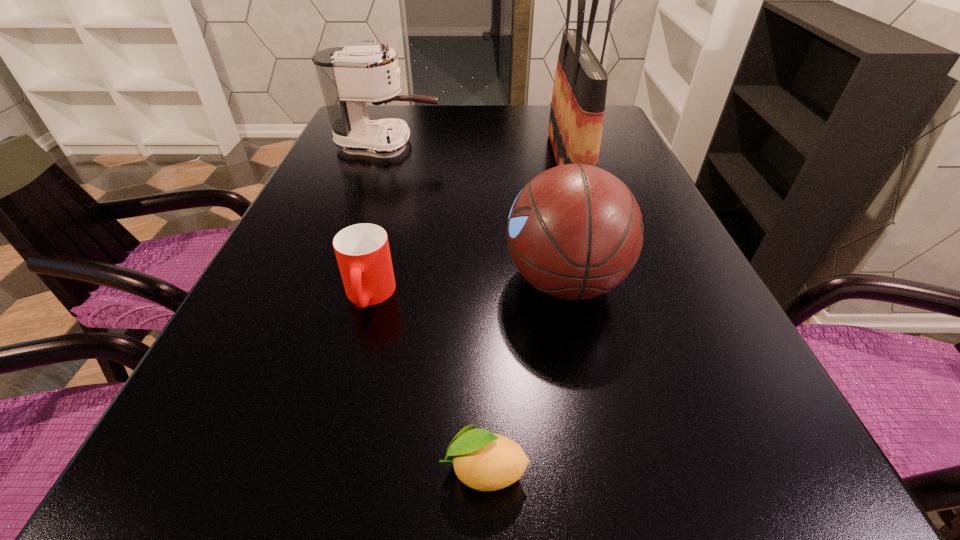
Image resolution: width=960 pixels, height=540 pixels. Find the location of `basketball located at the right edge`. basketball located at the right edge is located at coordinates (575, 231).

Find the location of `object that is at the far left corner`. object that is at the far left corner is located at coordinates (349, 77).

Where is `object located in the far right corner section of the desktop`? The height and width of the screenshot is (540, 960). object located in the far right corner section of the desktop is located at coordinates (577, 110).

The image size is (960, 540). In the image, there is a desktop. In order to click on free space at the far edge in this screenshot , I will do [x=493, y=122].

Locate an element on the screen. This screenshot has height=540, width=960. free space at the near edge is located at coordinates (582, 527).

I want to click on vacant space at the left edge of the desktop, so click(x=332, y=153).

Identify the location of free space at the right edge. The height and width of the screenshot is (540, 960). (733, 427).

I want to click on empty location between the shopping bag and the nearest object, so click(x=526, y=316).

Identify the location of free area in between the coffee maker and the third tallest object. The width and height of the screenshot is (960, 540). (476, 213).

Locate an element on the screen. The height and width of the screenshot is (540, 960). free space between the coffee maker and the lemon is located at coordinates (436, 307).